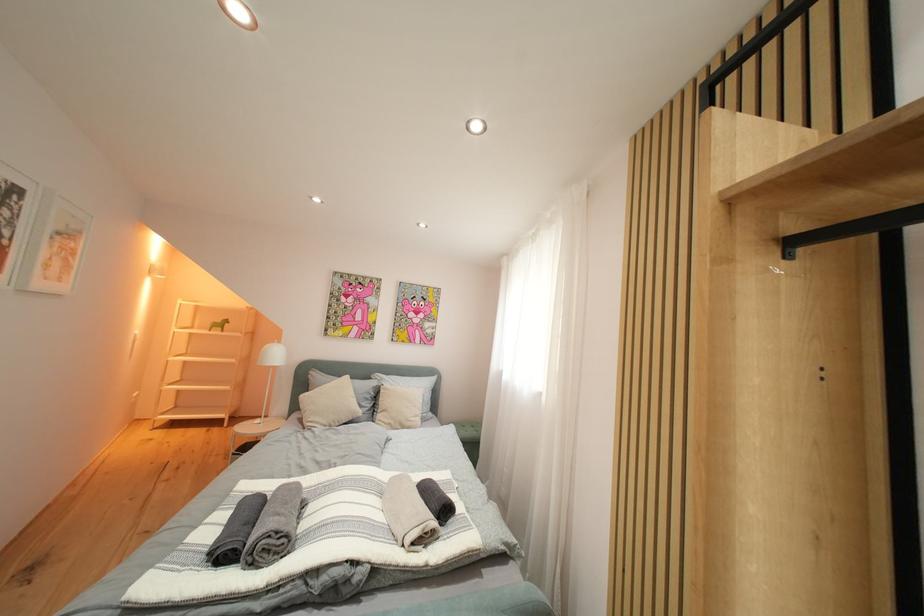
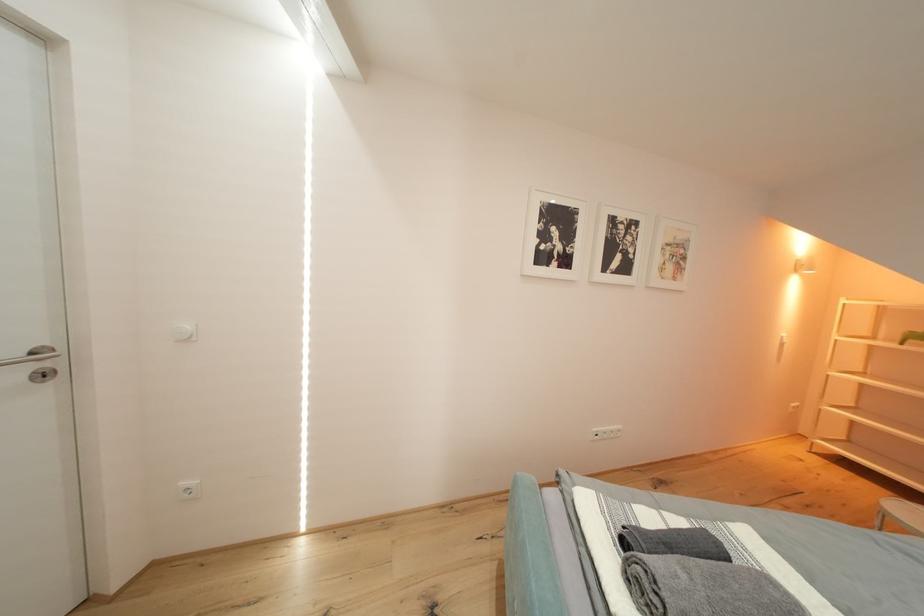
Question: How did the camera likely rotate?

Choices:
 (A) Left
 (B) Right
 (C) Up
 (D) Down

Answer: (A)